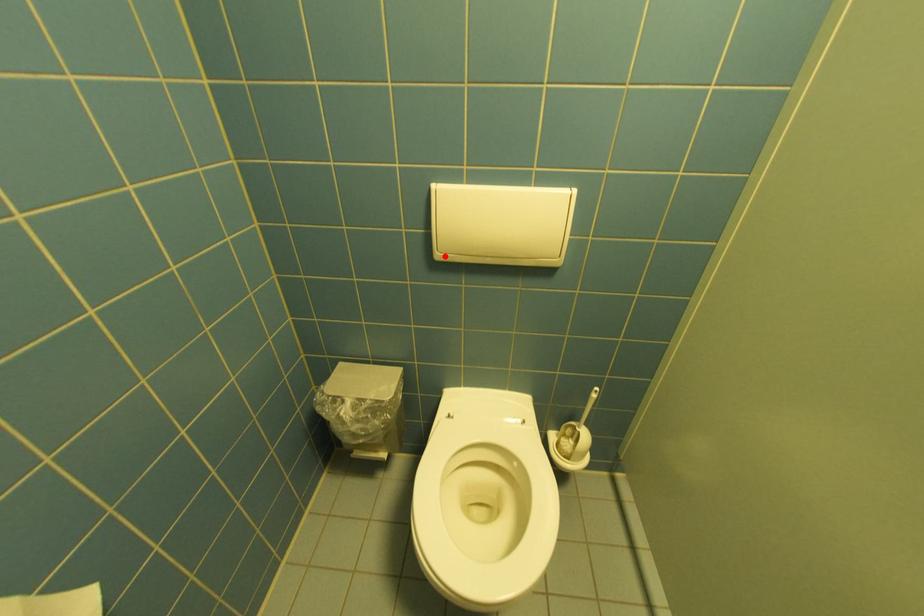
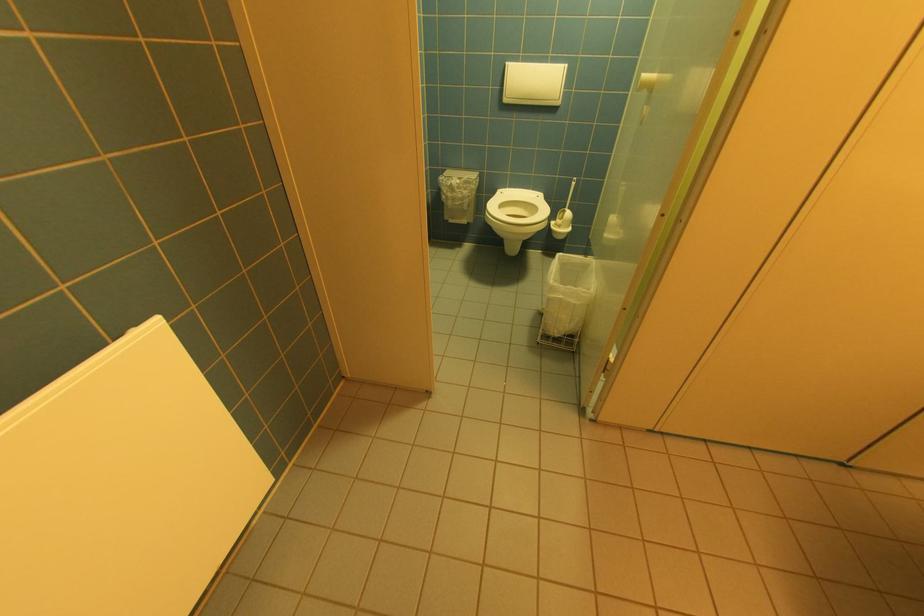
Where in the second image is the point corresponding to the highlighted location from the first image?

(512, 100)